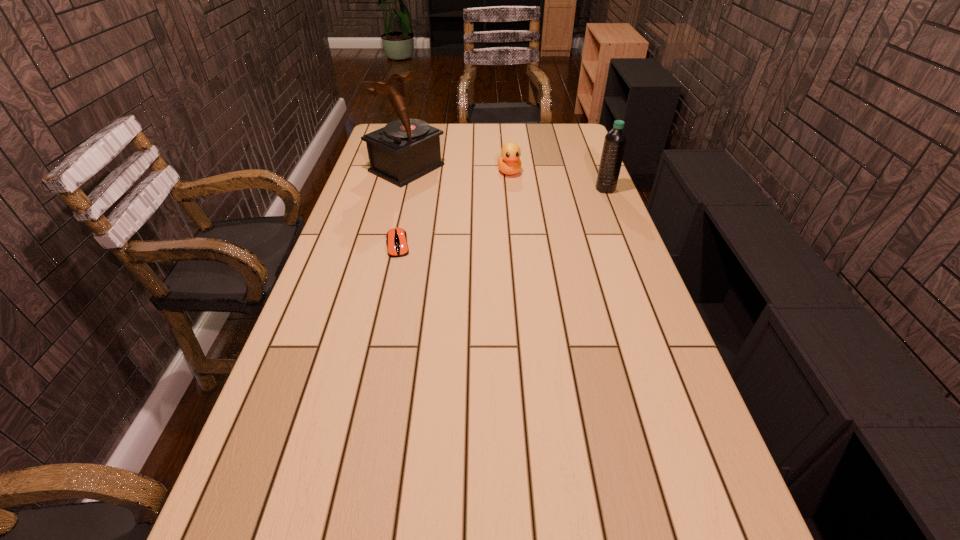
Image resolution: width=960 pixels, height=540 pixels. In order to click on vacant space located on the face of the third tallest object in this screenshot , I will do `click(532, 238)`.

This screenshot has width=960, height=540. I want to click on free space located 0.120m on the face of the third tallest object, so click(x=517, y=197).

Find the location of `vacant position located at the horn opening of the phonograph_record`. vacant position located at the horn opening of the phonograph_record is located at coordinates (469, 197).

Where is `vacant area situated 0.370m at the horn opening of the phonograph_record`? Image resolution: width=960 pixels, height=540 pixels. vacant area situated 0.370m at the horn opening of the phonograph_record is located at coordinates (513, 217).

I want to click on vacant space situated at the horn opening of the phonograph_record, so click(474, 199).

Locate an element on the screen. The height and width of the screenshot is (540, 960). object present at the left edge is located at coordinates (404, 150).

Locate an element on the screen. object that is at the right edge is located at coordinates click(x=615, y=140).

In order to click on free spot at the far edge of the desktop in this screenshot , I will do `click(481, 123)`.

I want to click on free point at the near edge, so click(x=525, y=481).

The image size is (960, 540). Find the location of `vacant region at the left edge of the desktop`. vacant region at the left edge of the desktop is located at coordinates (356, 226).